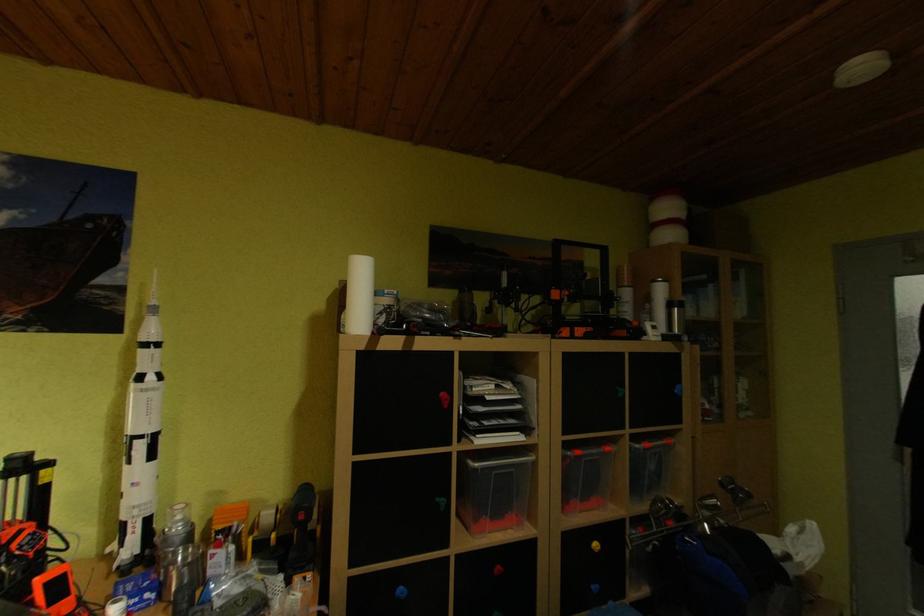
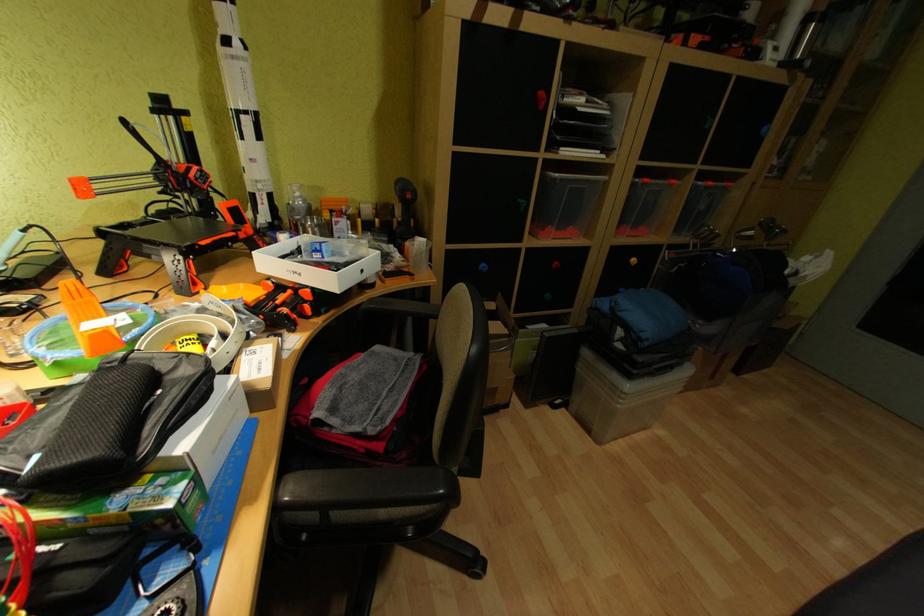
Question: How did the camera likely rotate?

Choices:
 (A) Left
 (B) Right
 (C) Up
 (D) Down

Answer: (D)